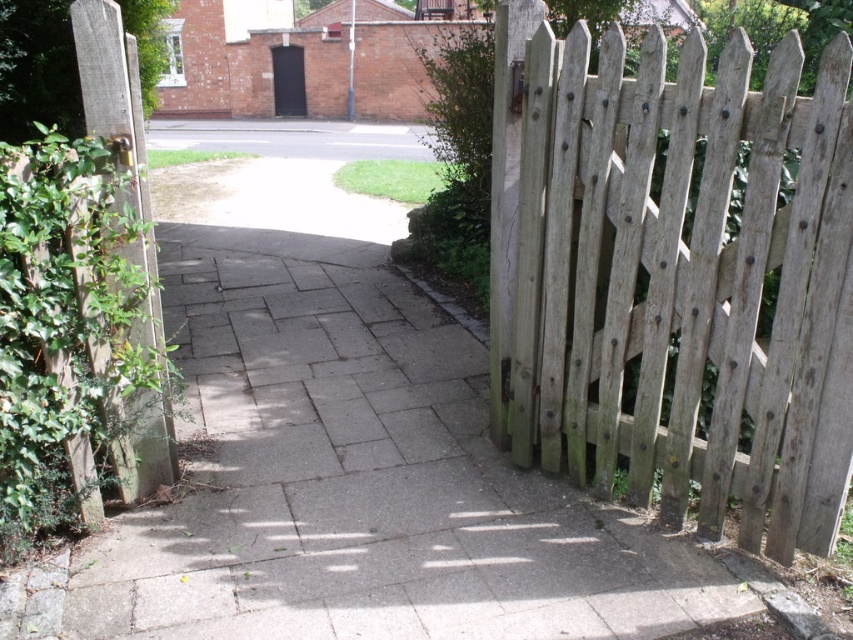
Question: Does gray concrete pavement at center appear under weathered wood fence at right?

Choices:
 (A) yes
 (B) no

Answer: (A)

Question: Which point is closer to the camera?

Choices:
 (A) weathered wood fence at right
 (B) gray concrete pavement at center

Answer: (A)

Question: Does gray concrete pavement at center have a greater width compared to weathered wood fence at right?

Choices:
 (A) yes
 (B) no

Answer: (A)

Question: Can you confirm if gray concrete pavement at center is positioned below weathered wood fence at right?

Choices:
 (A) yes
 (B) no

Answer: (A)

Question: Which object is farther from the camera taking this photo?

Choices:
 (A) weathered wood fence at right
 (B) gray concrete pavement at center

Answer: (B)